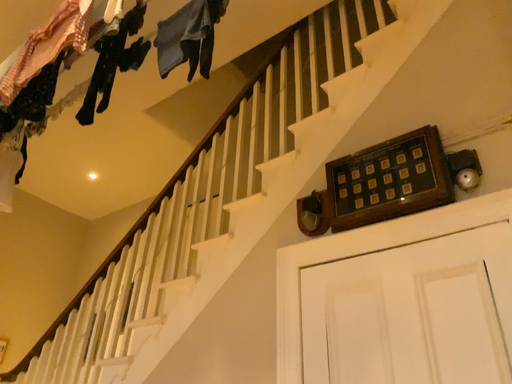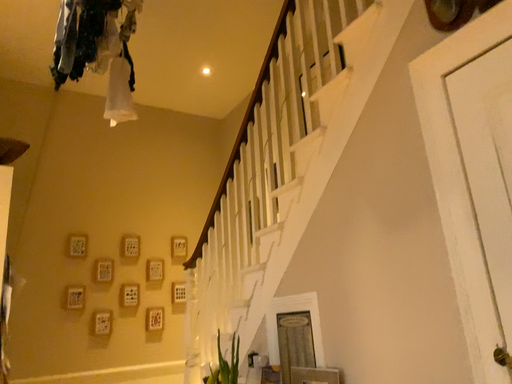
Question: Which way did the camera rotate in the video?

Choices:
 (A) rotated downward
 (B) rotated upward

Answer: (A)